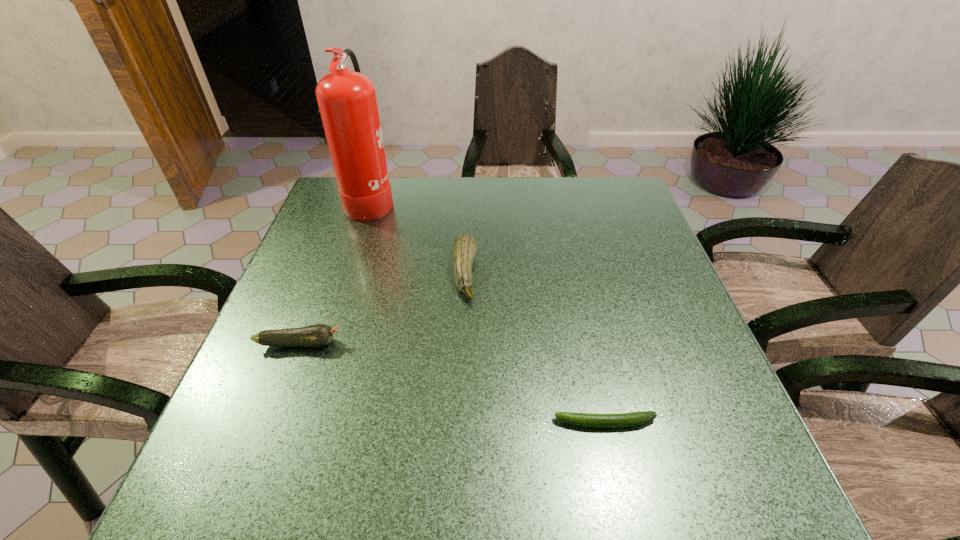
Identify the location of the tallest object. The width and height of the screenshot is (960, 540). (347, 101).

Where is `the farthest object`? the farthest object is located at coordinates (347, 101).

Locate an element on the screen. This screenshot has width=960, height=540. the tallest zucchini is located at coordinates (465, 246).

In order to click on the second object from right to left in this screenshot , I will do `click(465, 246)`.

Locate an element on the screen. The image size is (960, 540). the leftmost zucchini is located at coordinates (318, 335).

The width and height of the screenshot is (960, 540). Identify the location of the third tallest object. (318, 335).

Image resolution: width=960 pixels, height=540 pixels. I want to click on the rightmost object, so click(620, 420).

The height and width of the screenshot is (540, 960). In order to click on the shortest zucchini in this screenshot , I will do `click(620, 420)`.

Identify the location of vacant space located 0.110m towards the nozzle of the tallest object. (432, 199).

Where is `free region located 0.150m at the stem end of the second farthest object`? The image size is (960, 540). free region located 0.150m at the stem end of the second farthest object is located at coordinates (539, 273).